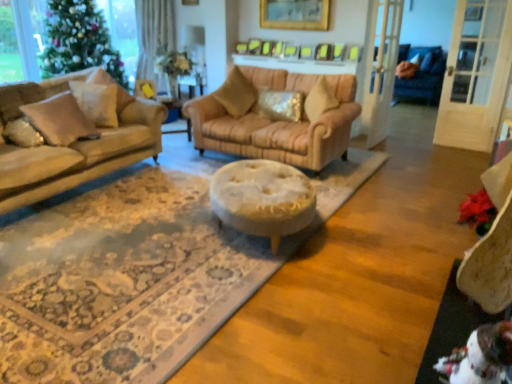
Question: From a real-world perspective, is green matte christmas tree at left below beige fabric pillow at left, the 2th pillow viewed from the left?

Choices:
 (A) no
 (B) yes

Answer: (A)

Question: Is green matte christmas tree at left facing away from beige fabric pillow at left, the 4th pillow positioned from the right?

Choices:
 (A) no
 (B) yes

Answer: (A)

Question: Is green matte christmas tree at left positioned far away from beige fabric pillow at left, the 4th pillow positioned from the right?

Choices:
 (A) no
 (B) yes

Answer: (B)

Question: From the image's perspective, would you say green matte christmas tree at left is shown under beige fabric pillow at left, the 4th pillow positioned from the right?

Choices:
 (A) no
 (B) yes

Answer: (A)

Question: From the image's perspective, does green matte christmas tree at left appear higher than beige fabric pillow at left, the 4th pillow positioned from the right?

Choices:
 (A) yes
 (B) no

Answer: (A)

Question: Is green matte christmas tree at left shorter than beige fabric pillow at left, the 4th pillow positioned from the right?

Choices:
 (A) no
 (B) yes

Answer: (A)

Question: Is green matte christmas tree at left wider than matte gold pillow at left, the 5th pillow in the right-to-left sequence?

Choices:
 (A) yes
 (B) no

Answer: (A)

Question: Can you confirm if green matte christmas tree at left is smaller than matte gold pillow at left, the 5th pillow in the right-to-left sequence?

Choices:
 (A) yes
 (B) no

Answer: (B)

Question: Considering the relative positions of green matte christmas tree at left and matte gold pillow at left, the 1th pillow in the left-to-right sequence, in the image provided, is green matte christmas tree at left in front of matte gold pillow at left, the 1th pillow in the left-to-right sequence,?

Choices:
 (A) no
 (B) yes

Answer: (A)

Question: From the image's perspective, is green matte christmas tree at left located above matte gold pillow at left, the 1th pillow in the left-to-right sequence?

Choices:
 (A) yes
 (B) no

Answer: (A)

Question: Does green matte christmas tree at left have a lesser width compared to matte gold pillow at left, the 5th pillow in the right-to-left sequence?

Choices:
 (A) no
 (B) yes

Answer: (A)

Question: Considering the relative positions of green matte christmas tree at left and matte gold pillow at left, the 1th pillow in the left-to-right sequence, in the image provided, is green matte christmas tree at left to the left of matte gold pillow at left, the 1th pillow in the left-to-right sequence, from the viewer's perspective?

Choices:
 (A) no
 (B) yes

Answer: (B)

Question: From the image's perspective, is velvet beige swivel chair at lower right below beige fabric pillow at left, the 2th pillow viewed from the left?

Choices:
 (A) no
 (B) yes

Answer: (B)